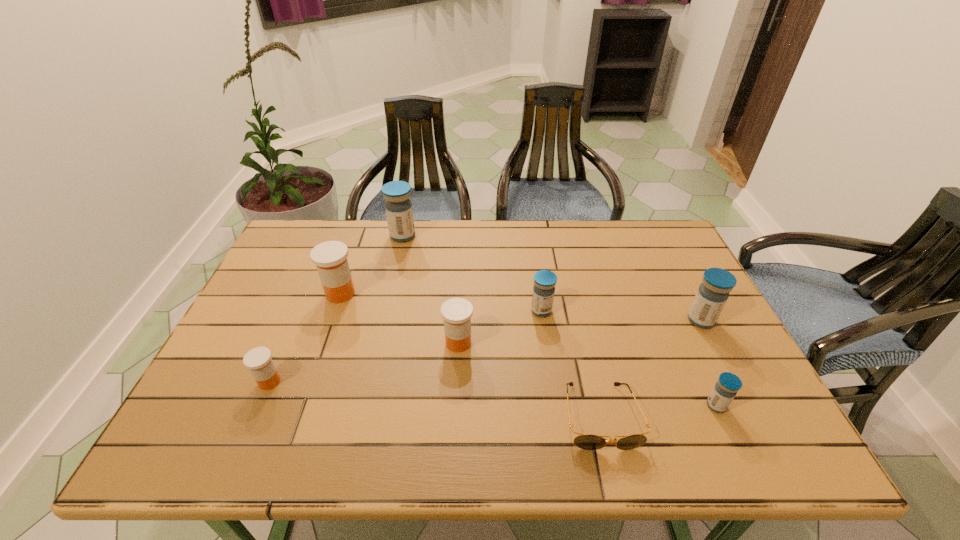
This screenshot has width=960, height=540. What are the coordinates of `the tallest medicine` in the screenshot? It's located at (398, 206).

Image resolution: width=960 pixels, height=540 pixels. Identify the location of the tallest object. pos(398,206).

Locate an element on the screen. The image size is (960, 540). the second object from left to right is located at coordinates (330, 258).

Where is `the farthest orange medicine`? The width and height of the screenshot is (960, 540). the farthest orange medicine is located at coordinates (330, 258).

This screenshot has width=960, height=540. What are the coordinates of `the rightmost blue medicine` in the screenshot? It's located at (713, 293).

Image resolution: width=960 pixels, height=540 pixels. I want to click on the third smallest blue medicine, so click(x=713, y=293).

At what (x,y) coordinates should I click in order to perform the action: click on the third nearest medicine. Please return your answer as a coordinate pair (x, y). Image resolution: width=960 pixels, height=540 pixels. Looking at the image, I should click on (457, 312).

You are a GUI agent. You are given a task and a screenshot of the screen. Output one action in this format:
    pyautogui.click(x=<x>, y=<y>)
    Task: Click on the second farthest orange medicine
    The image size is (960, 540).
    Given the screenshot: What is the action you would take?
    pyautogui.click(x=457, y=312)

Identify the location of the third biggest blue medicine. (544, 281).

You are a GUI agent. You are given a task and a screenshot of the screen. Output one action in this format:
    pyautogui.click(x=<x>, y=<y>)
    Task: Click on the second blue medicine from left to right
    
    Given the screenshot: What is the action you would take?
    pyautogui.click(x=544, y=281)